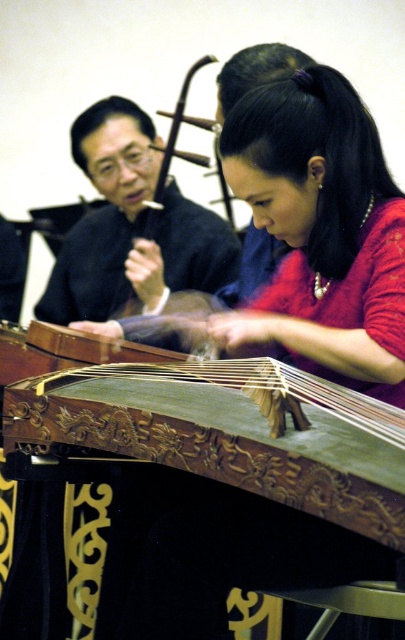
Between matte green wooden instrument at center and matte black robe at upper left, which one is positioned higher?

Positioned higher is matte black robe at upper left.

Identify the location of matte green wooden instrument at center. The height and width of the screenshot is (640, 405). (321, 230).

Find the location of a particular element. matte green wooden instrument at center is located at coordinates (321, 230).

Is carved wood zither at center shorter than matte black robe at upper left?

Yes.

Which is below, carved wood zither at center or matte black robe at upper left?

carved wood zither at center is below.

In the scene shown: Who is more distant from viewer, (74,355) or (121,248)?

The point (121,248) is behind.

At what (x,y) coordinates should I click in order to perform the action: click on carved wood zither at center. Please return your answer as a coordinate pair (x, y). This screenshot has width=405, height=640. Looking at the image, I should click on (219, 428).

Is carved wood zither at center smaller than matte green wooden instrument at center?

Incorrect, carved wood zither at center is not smaller in size than matte green wooden instrument at center.

Who is more distant from viewer, (387, 424) or (302, 275)?

The point (302, 275) is more distant.

Image resolution: width=405 pixels, height=640 pixels. What do you see at coordinates (219, 428) in the screenshot?
I see `carved wood zither at center` at bounding box center [219, 428].

At what (x,y) coordinates should I click in order to perform the action: click on carved wood zither at center. Please return your answer as a coordinate pair (x, y). The width and height of the screenshot is (405, 640). Looking at the image, I should click on (219, 428).